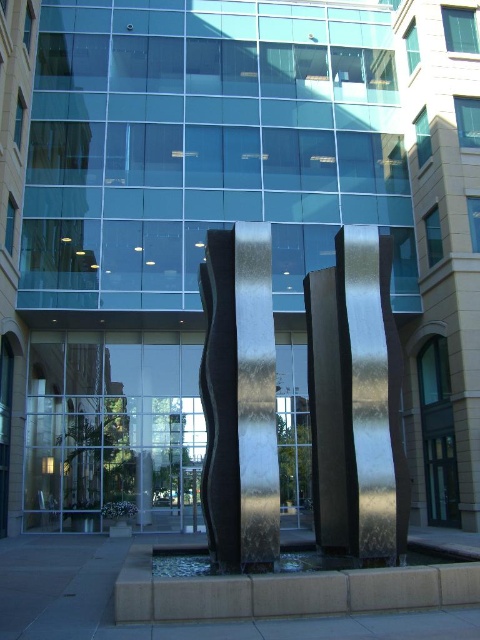
Can you confirm if polished bronze sculpture at center is shorter than polished black sculpture at center?

Correct, polished bronze sculpture at center is not as tall as polished black sculpture at center.

Between polished bronze sculpture at center and polished black sculpture at center, which one has less height?

With less height is polished bronze sculpture at center.

At what (x,y) coordinates should I click in order to perform the action: click on polished bronze sculpture at center. Please return your answer as a coordinate pair (x, y). The width and height of the screenshot is (480, 640). Looking at the image, I should click on (356, 401).